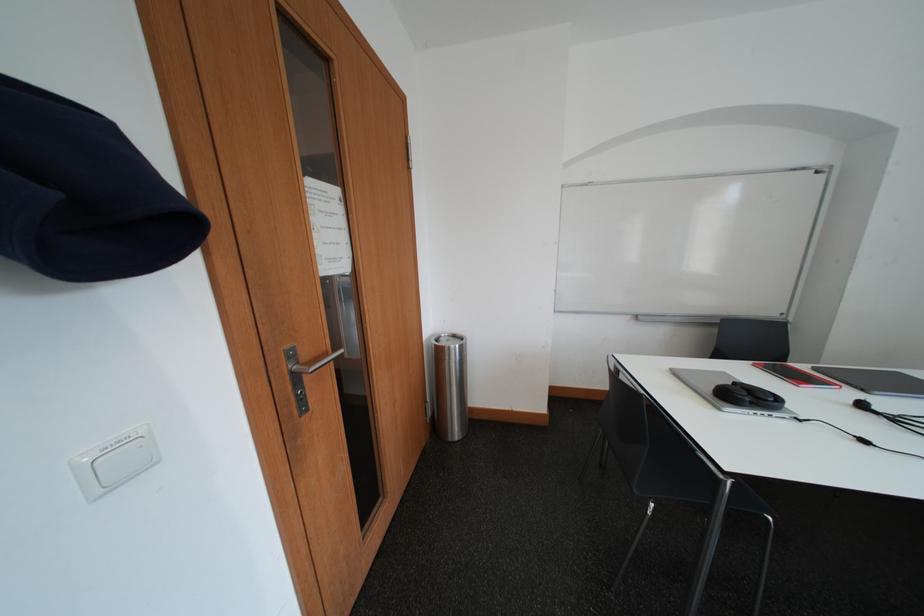
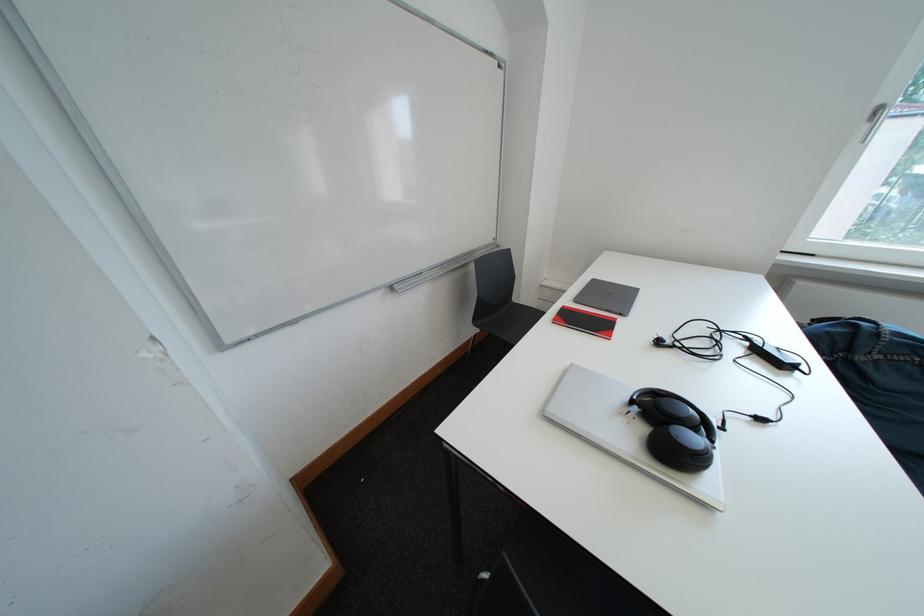
Locate, in the second image, the point that corresponds to [648,321] in the first image.

(403, 292)